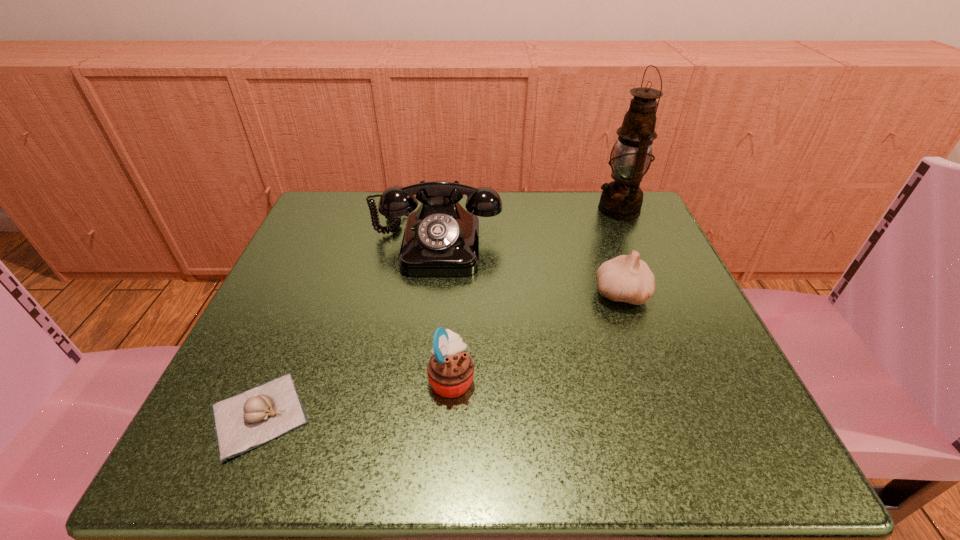
Find the location of a particular element. This screenshot has width=960, height=540. object situated at the near left corner is located at coordinates (242, 422).

Where is `object present at the far right corner`? object present at the far right corner is located at coordinates (622, 199).

At what (x,y) coordinates should I click in order to perform the action: click on free space at the far edge of the desktop. Please return your answer as a coordinate pair (x, y). Looking at the image, I should click on (527, 230).

The height and width of the screenshot is (540, 960). In the image, there is a desktop. Identify the location of free space at the near edge. (370, 413).

You are a GUI agent. You are given a task and a screenshot of the screen. Output one action in this format:
    pyautogui.click(x=<x>, y=<y>)
    Task: Click on the free space at the left edge
    The image size is (960, 540).
    Given the screenshot: What is the action you would take?
    pyautogui.click(x=310, y=332)

Identify the location of free spot at the right edge of the desktop. (668, 294).

In order to click on vacant space at the far left corner in this screenshot , I will do `click(303, 238)`.

Find the location of a particular element. free space at the far right corner is located at coordinates (651, 246).

In the image, there is a desktop. Find the location of `vacant space at the near right corner`. vacant space at the near right corner is located at coordinates [x=767, y=447].

Find the location of a particular element. The image size is (960, 540). free space between the telephone and the oil lamp is located at coordinates tap(527, 226).